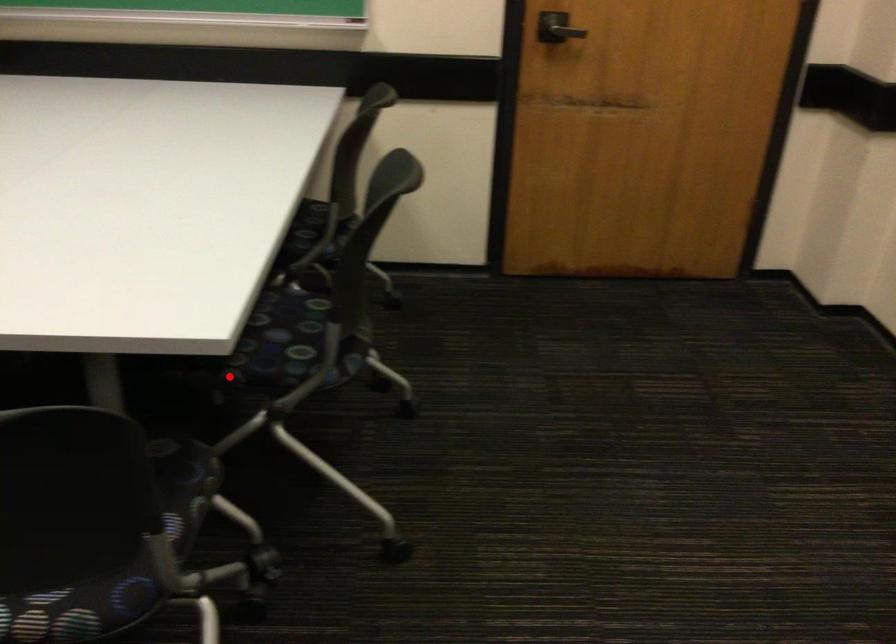
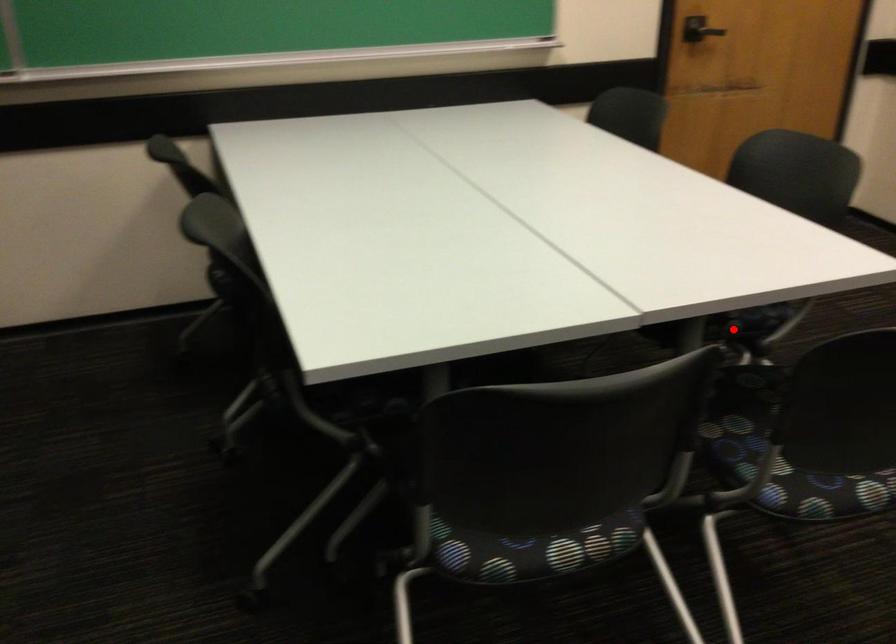
I am providing you with two images of the same scene from different viewpoints. A red point is marked on the first image and another point is marked on the second image. Is the red point in image1 aligned with the point shown in image2?

Yes